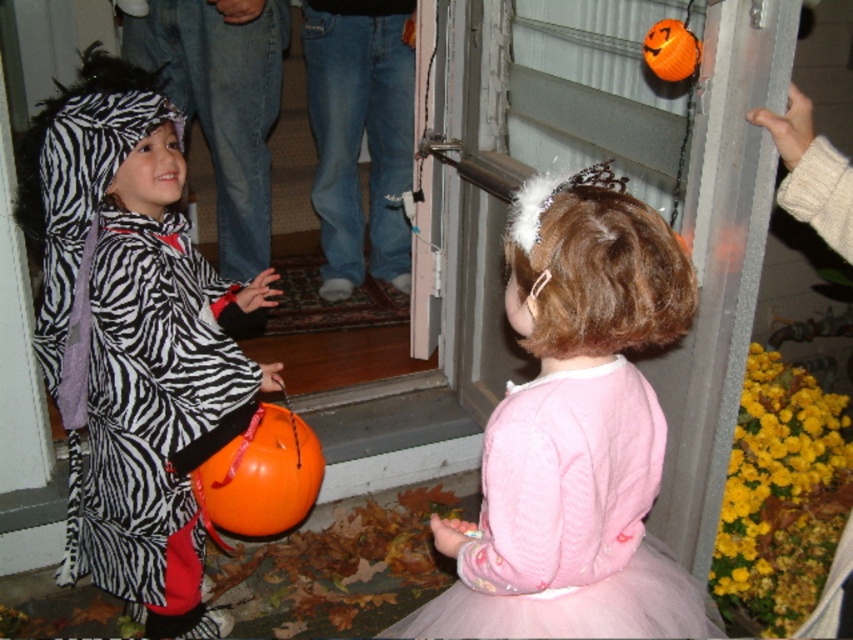
Question: Which is nearer to the pink satin dress at center?

Choices:
 (A) orange matte pumpkin at upper right
 (B) zebra print costume at left
 (C) orange matte pumpkin at lower left

Answer: (C)

Question: Where is zebra print costume at left located in relation to pink satin dress at center in the image?

Choices:
 (A) right
 (B) left

Answer: (B)

Question: Is zebra print costume at left wider than orange matte pumpkin at upper right?

Choices:
 (A) yes
 (B) no

Answer: (A)

Question: Which point is farther to the camera?

Choices:
 (A) orange matte pumpkin at upper right
 (B) zebra print costume at left
 (C) pink satin dress at center
 (D) orange matte pumpkin at lower left

Answer: (D)

Question: Does pink satin dress at center have a larger size compared to orange matte pumpkin at upper right?

Choices:
 (A) no
 (B) yes

Answer: (B)

Question: Which of the following is the farthest from the observer?

Choices:
 (A) (107, 220)
 (B) (541, 264)
 (C) (265, 449)
 (D) (654, 68)

Answer: (C)